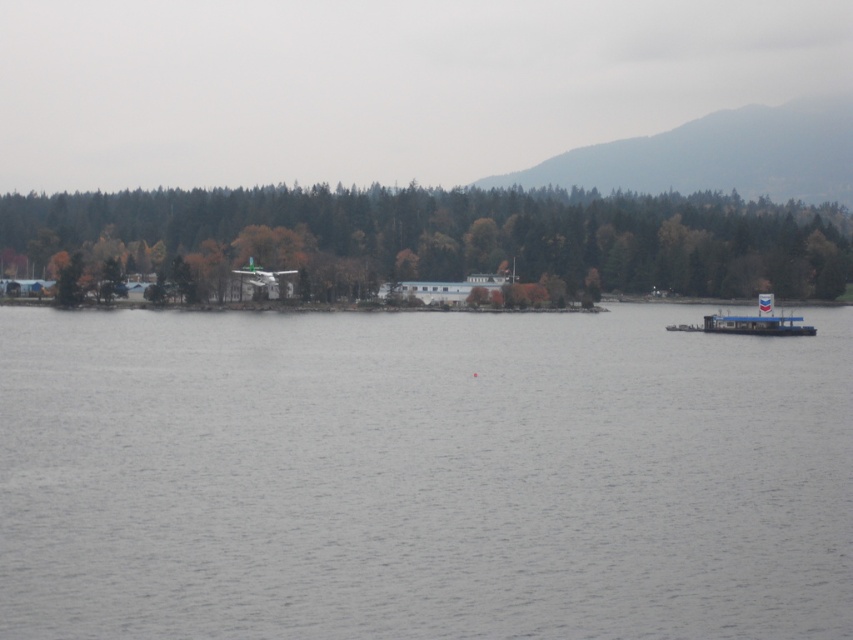
Question: Which point is farther to the camera?

Choices:
 (A) green matte tree at center
 (B) gray water at center

Answer: (A)

Question: Which of these objects is positioned closest to the green matte tree at center?

Choices:
 (A) gray water at center
 (B) blue plastic boat at right

Answer: (B)

Question: In this image, where is gray water at center located relative to green matte tree at center?

Choices:
 (A) above
 (B) below

Answer: (B)

Question: Which point is closer to the camera?

Choices:
 (A) blue plastic boat at right
 (B) green matte tree at center

Answer: (A)

Question: Is gray water at center to the right of blue plastic boat at right from the viewer's perspective?

Choices:
 (A) no
 (B) yes

Answer: (A)

Question: Considering the relative positions of green matte tree at center and blue plastic boat at right in the image provided, where is green matte tree at center located with respect to blue plastic boat at right?

Choices:
 (A) left
 (B) right

Answer: (A)